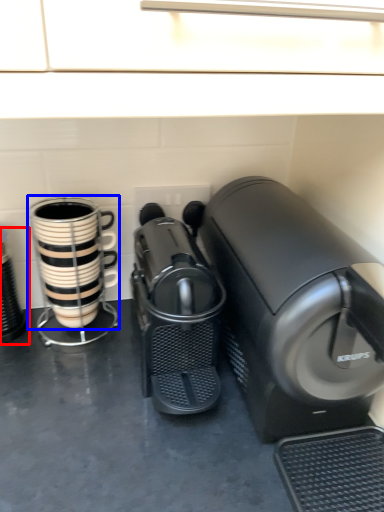
Question: Which point is closer to the camera, appliance (highlighted by a red box) or coffee cup (highlighted by a blue box)?

Choices:
 (A) appliance
 (B) coffee cup

Answer: (B)